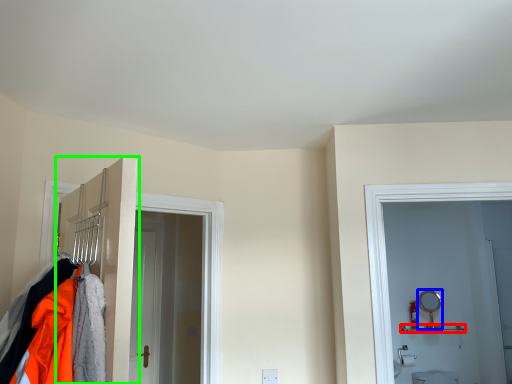
Question: Based on their relative distances, which object is farther from shelf (highlighted by a red box)? Choose from mirror (highlighted by a blue box) and door (highlighted by a green box).

Choices:
 (A) mirror
 (B) door

Answer: (B)